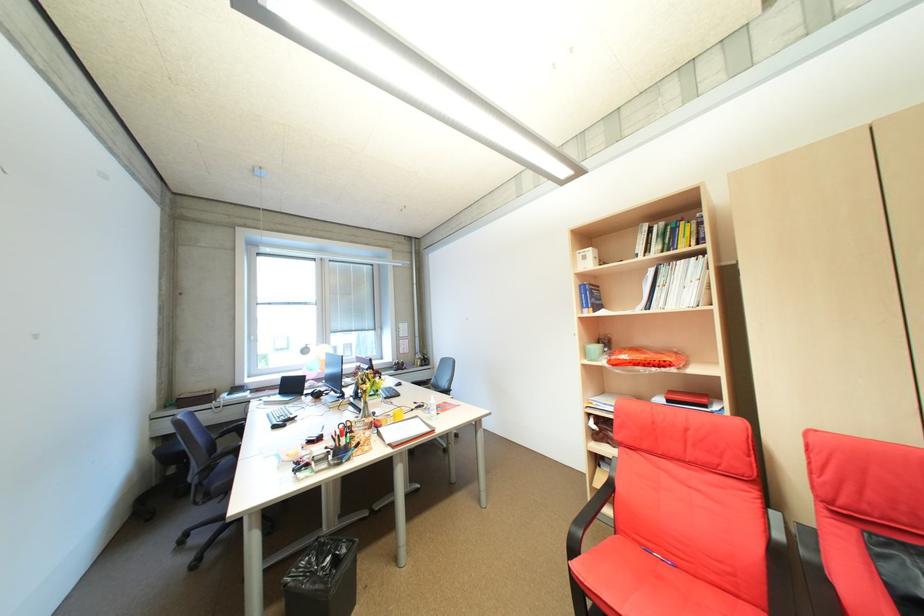
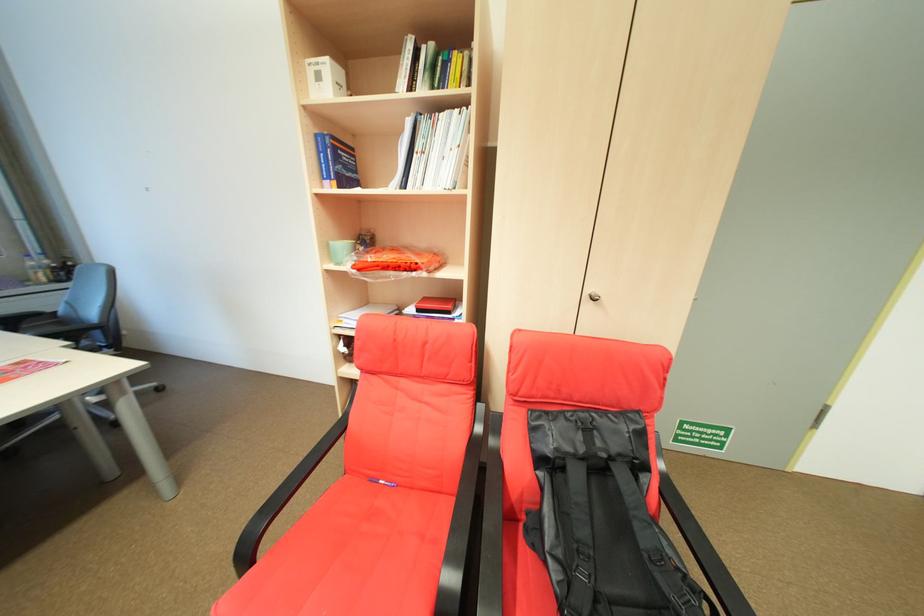
How did the camera likely rotate?

The camera rotated toward right-down.